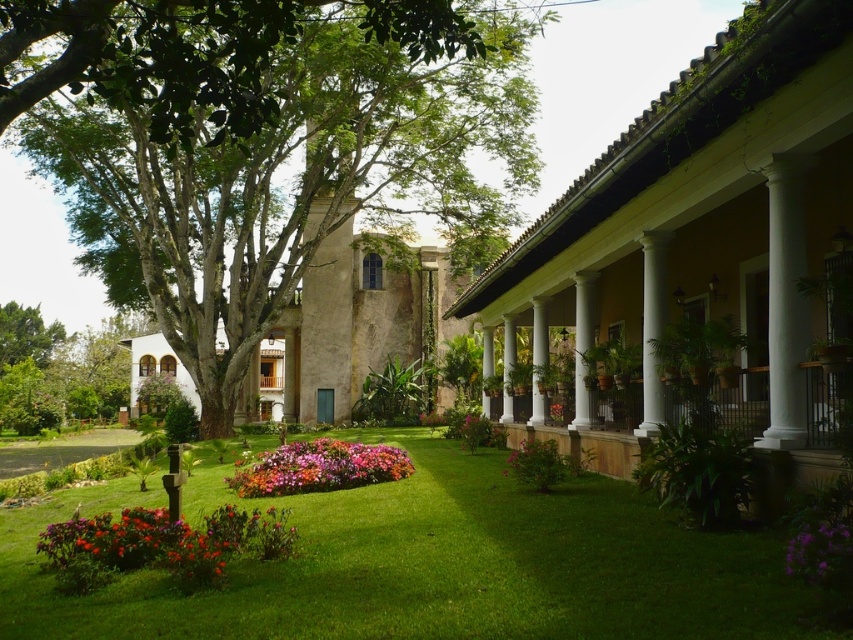
Question: Based on their relative distances, which object is nearer to the purple matte flower at center?

Choices:
 (A) white smooth column at center
 (B) green leafy tree at center
 (C) vibrant floral bed at center
 (D) green leafy tree at upper left

Answer: (C)

Question: Is green leafy tree at center further to camera compared to purple matte flower at center?

Choices:
 (A) no
 (B) yes

Answer: (A)

Question: Which object is farther from the camera taking this photo?

Choices:
 (A) white stone column at center
 (B) white smooth column at right
 (C) vibrant floral bed at center
 (D) white glossy column at center

Answer: (A)

Question: Is green leafy tree at upper left in front of white smooth column at center?

Choices:
 (A) no
 (B) yes

Answer: (B)

Question: Does green leafy tree at center have a larger size compared to white stone column at center?

Choices:
 (A) no
 (B) yes

Answer: (B)

Question: Which of the following is the farthest from the observer?

Choices:
 (A) (585, 292)
 (B) (244, 474)
 (C) (195, 305)
 (D) (769, 268)

Answer: (C)